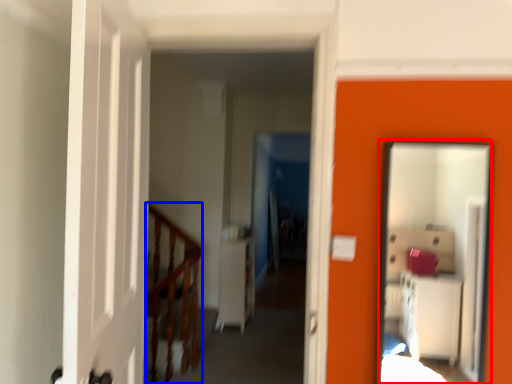
Question: Which of the following is the closest to the observer, mirror (highlighted by a red box) or rail (highlighted by a blue box)?

Choices:
 (A) mirror
 (B) rail

Answer: (A)